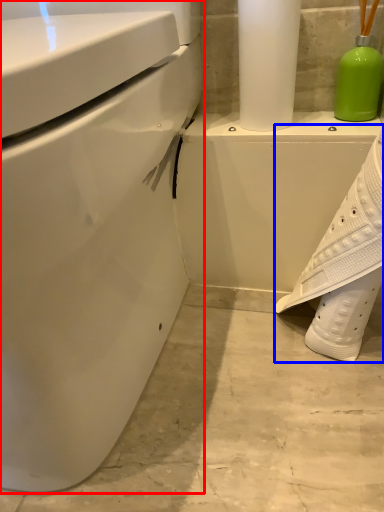
Question: Which object is closer to the camera taking this photo, toilet (highlighted by a red box) or shoe (highlighted by a blue box)?

Choices:
 (A) toilet
 (B) shoe

Answer: (A)